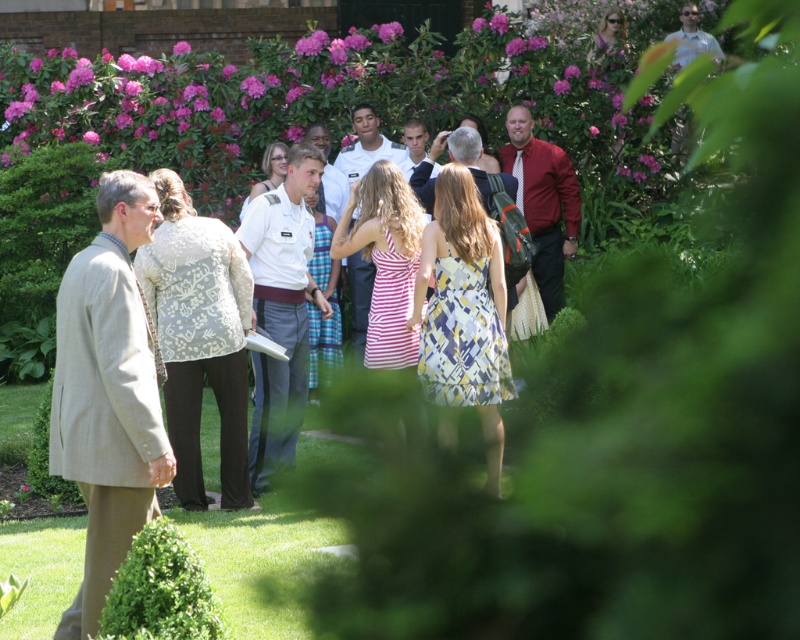
Can you confirm if white uniform at center is bigger than white uniform shirt at center?

Correct, white uniform at center is larger in size than white uniform shirt at center.

Can you confirm if white uniform at center is shorter than white uniform shirt at center?

No, white uniform at center is not shorter than white uniform shirt at center.

Between point (322, 166) and point (360, 321), which one is positioned behind?

Positioned behind is point (360, 321).

The image size is (800, 640). I want to click on white uniform at center, so click(x=281, y=310).

Is beige textured blazer at left to the left of white uniform at center from the viewer's perspective?

Indeed, beige textured blazer at left is positioned on the left side of white uniform at center.

Measure the distance between beige textured blazer at left and camera.

The distance of beige textured blazer at left from camera is 7.59 meters.

Locate an element on the screen. This screenshot has height=640, width=800. beige textured blazer at left is located at coordinates (108, 392).

Can you confirm if beige textured blazer at left is wider than matte red shirt at center?

Incorrect, beige textured blazer at left's width does not surpass matte red shirt at center's.

Can you confirm if beige textured blazer at left is positioned below matte red shirt at center?

Correct, beige textured blazer at left is located below matte red shirt at center.

At what (x,y) coordinates should I click in order to perform the action: click on beige textured blazer at left. Please return your answer as a coordinate pair (x, y). Looking at the image, I should click on (108, 392).

Locate an element on the screen. This screenshot has width=800, height=640. beige textured blazer at left is located at coordinates (108, 392).